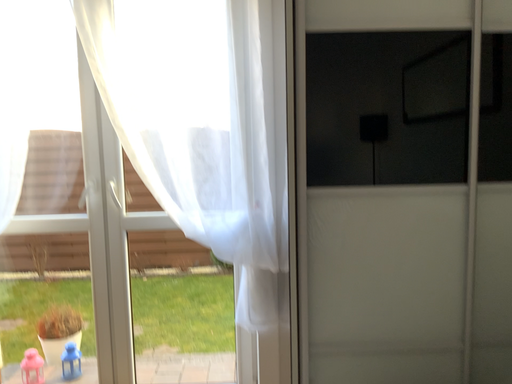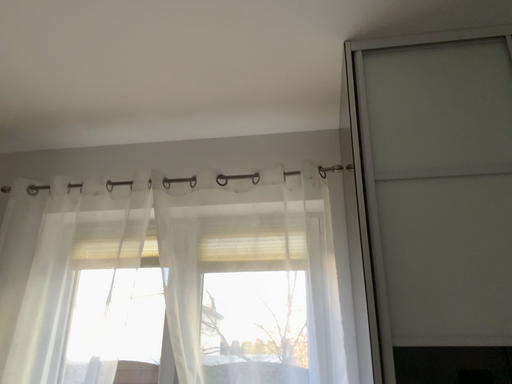
Question: Which way did the camera rotate in the video?

Choices:
 (A) rotated left
 (B) rotated right

Answer: (A)